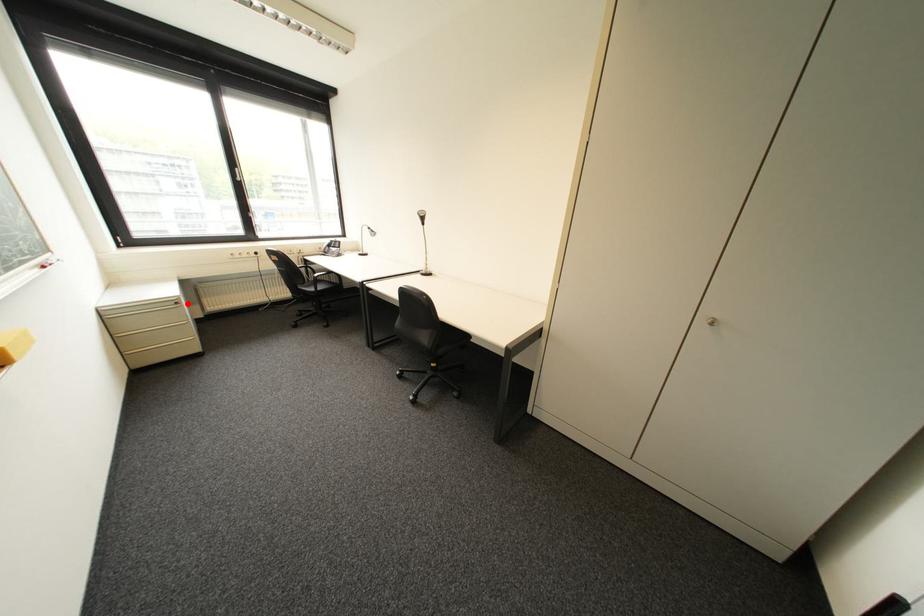
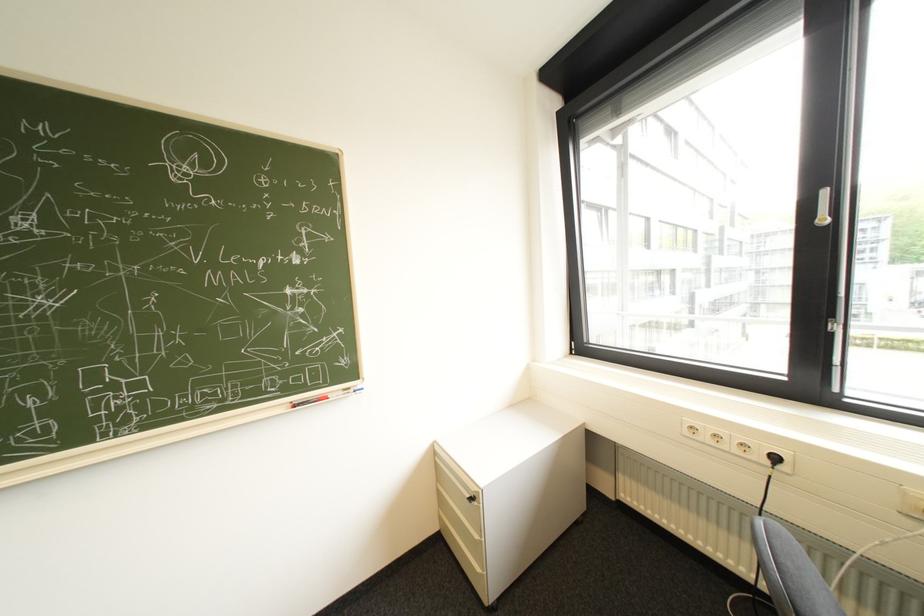
Question: I am providing you with two images of the same scene from different viewpoints. In image1, a red point is highlighted. Considering the same 3D point in image2, which of the following is correct?

Choices:
 (A) It is closer
 (B) It is farther

Answer: (B)